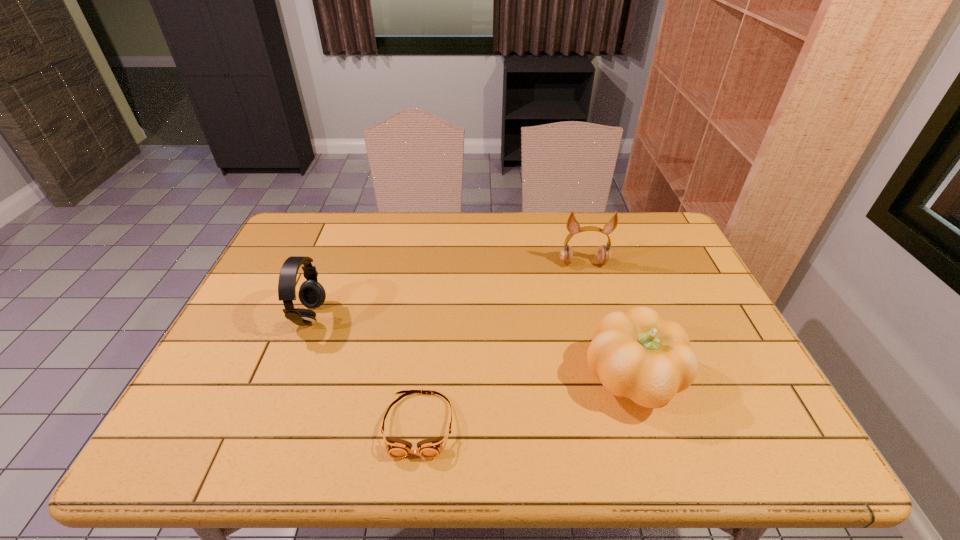
The image size is (960, 540). I want to click on the right earphone, so click(604, 254).

Where is `the farthest object`? the farthest object is located at coordinates (604, 254).

Locate an element on the screen. The image size is (960, 540). the second farthest object is located at coordinates (311, 294).

Locate an element on the screen. This screenshot has width=960, height=540. the leftmost object is located at coordinates (311, 294).

Identify the location of pumpkin. Image resolution: width=960 pixels, height=540 pixels. (636, 354).

The image size is (960, 540). In order to click on goggles in this screenshot , I will do `click(430, 448)`.

Find the location of a particular element. the shortest object is located at coordinates (430, 448).

In order to click on blank space located 0.230m on the front-facing side of the farther earphone in this screenshot , I will do `click(601, 324)`.

Locate an element on the screen. The height and width of the screenshot is (540, 960). vacant area situated on the ear cups of the second farthest object is located at coordinates (382, 317).

At what (x,y) coordinates should I click in order to perform the action: click on free space located on the left of the pumpkin. Please return your answer as a coordinate pair (x, y). This screenshot has height=540, width=960. Looking at the image, I should click on [x=486, y=379].